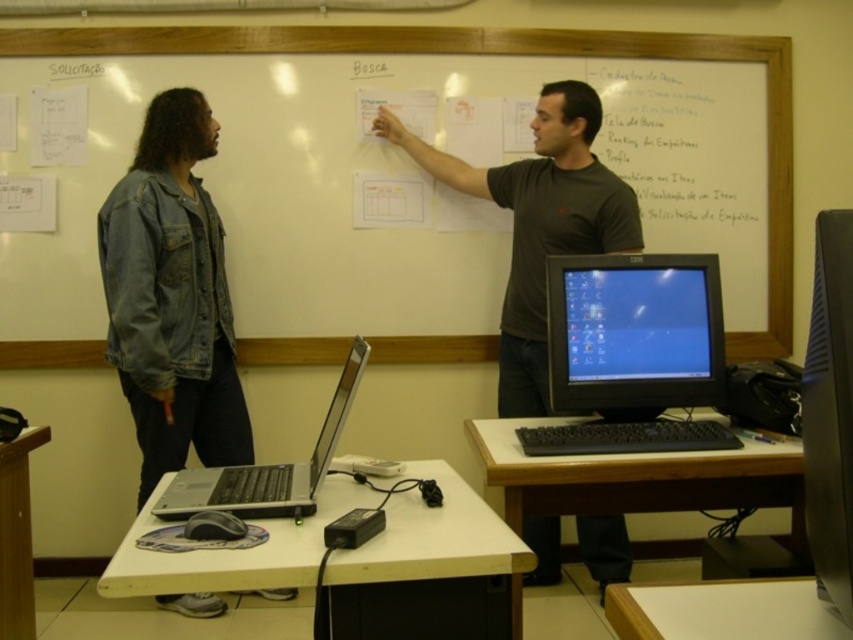
Question: Which of the following is the farthest from the observer?

Choices:
 (A) dark gray t-shirt at upper center
 (B) white matte table at lower center
 (C) denim jacket at left

Answer: (A)

Question: From the image, what is the correct spatial relationship of white wood table at lower center in relation to wooden podium at lower left?

Choices:
 (A) below
 (B) above

Answer: (B)

Question: Is white matte table at lower center positioned before wooden podium at lower left?

Choices:
 (A) no
 (B) yes

Answer: (B)

Question: Where is black glossy monitor at center located in relation to wooden podium at lower left in the image?

Choices:
 (A) right
 (B) left

Answer: (A)

Question: Estimate the real-world distances between objects in this image. Which object is farther from the black glossy monitor at center?

Choices:
 (A) white matte table at lower center
 (B) white wood table at lower center

Answer: (B)

Question: Which object appears farthest from the camera in this image?

Choices:
 (A) denim jacket at left
 (B) white wood table at lower center

Answer: (A)